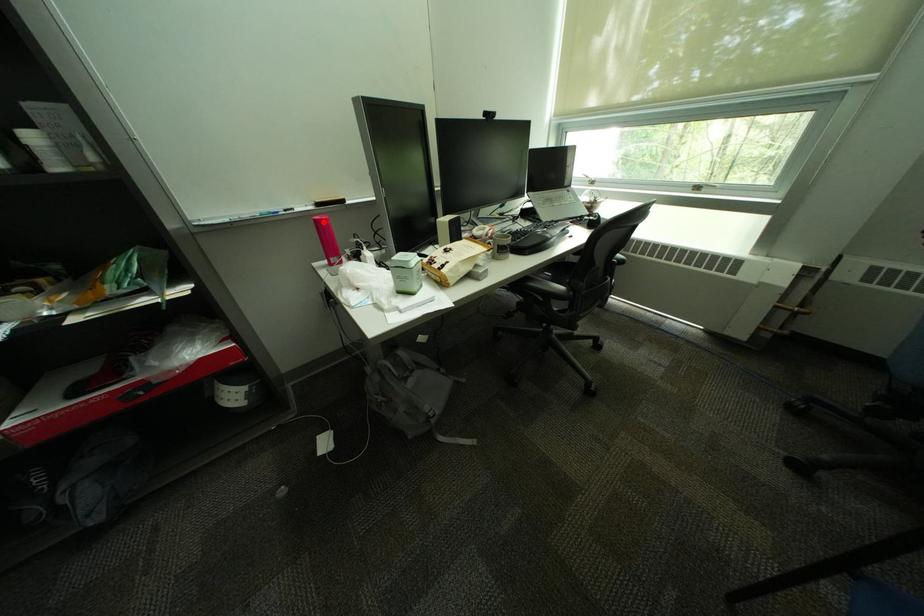
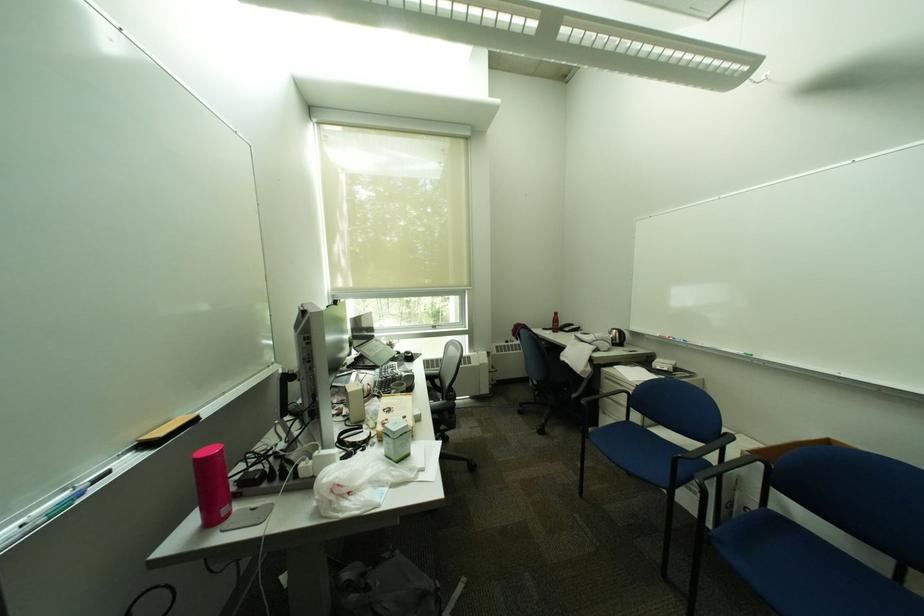
The point at the highlighted location is marked in the first image. Where is the corresponding point in the second image?

(202, 464)